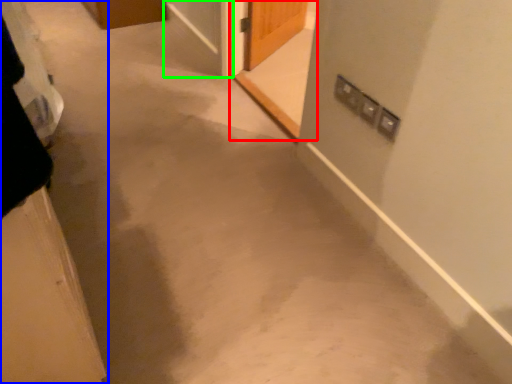
Question: Considering the real-world distances, which object is closest to screen door (highlighted by a red box)? door (highlighted by a blue box) or screen door (highlighted by a green box).

Choices:
 (A) door
 (B) screen door

Answer: (B)